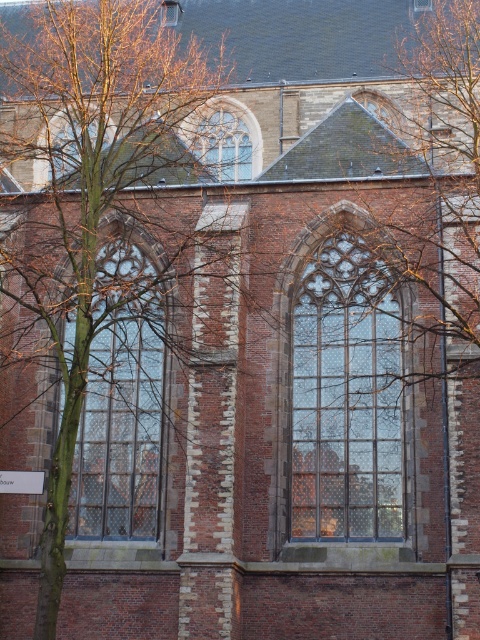
You are standing in front of the historic brick building and want to locate the clear glass window at left. According to the coordinates provided, where exactly should you look?

The clear glass window at left is located at point (120, 403).

You are an architect analyzing the Gothic building. You need to compare the sizes of the clear glass window at left and the clear glass window at upper center. Which one is bigger?

The clear glass window at left is larger in size than the clear glass window at upper center.

You are an architect analyzing the Gothic building. You notice two clear glass windows. The clear glass window at center and the clear glass window at upper center. Which one has a greater width?

The clear glass window at center has a greater width than the clear glass window at upper center.